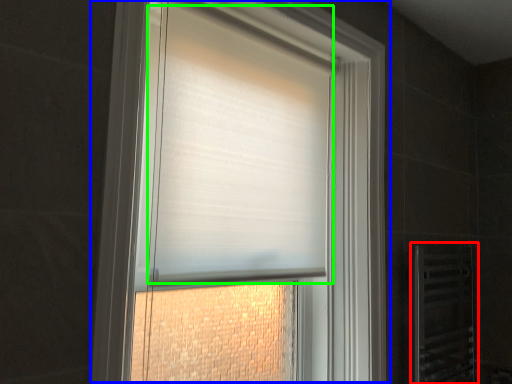
Question: Which object is positioned farthest from screen door (highlighted by a red box)? Select from window (highlighted by a blue box) and blind (highlighted by a green box).

Choices:
 (A) window
 (B) blind

Answer: (B)